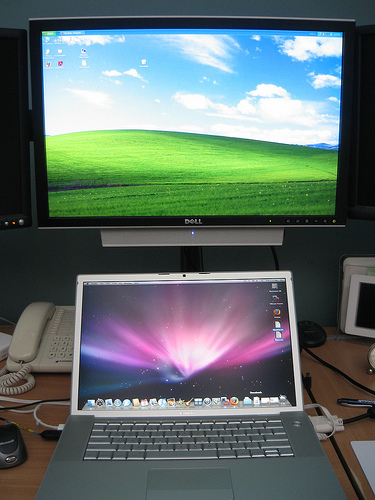
Identify the location of laptop mouse square. Image resolution: width=375 pixels, height=500 pixels. (176, 483).